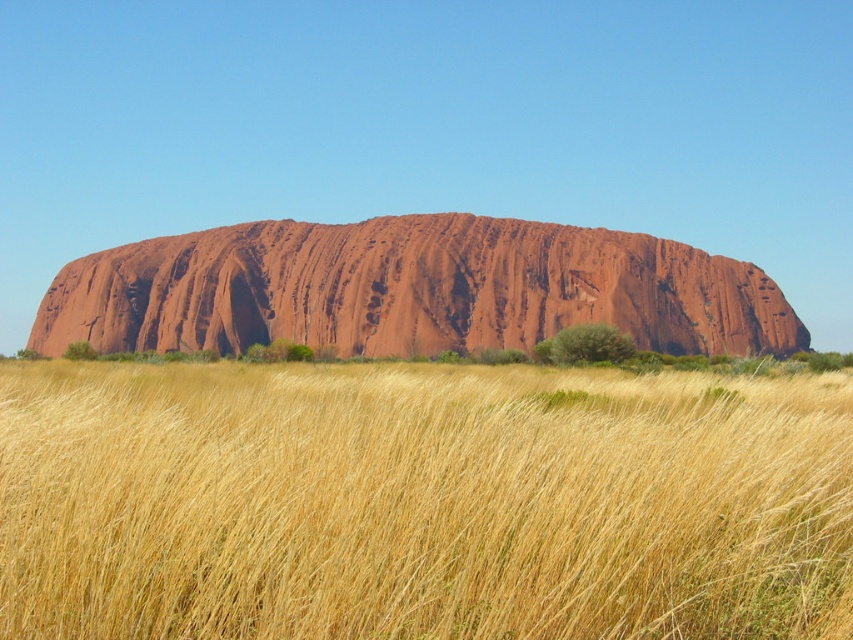
You are a photographer standing at the base of the rustic sandstone rock formation at center. You want to capture a shot that includes both the yellow grass at center and the rock formation. Which direction should you face to ensure both are visible in your frame?

You should face downward to include both the yellow grass at center, which is located below the rustic sandstone rock formation at center, in your frame.

You are a photographer planning to capture the rustic sandstone rock formation at center and the yellow grass at center in a single shot. Based on their sizes, which object should you focus on to ensure both are visible in the frame?

Since the yellow grass at center is smaller than the rustic sandstone rock formation at center, you should focus on the rustic sandstone rock formation at center to ensure both are visible in the frame.